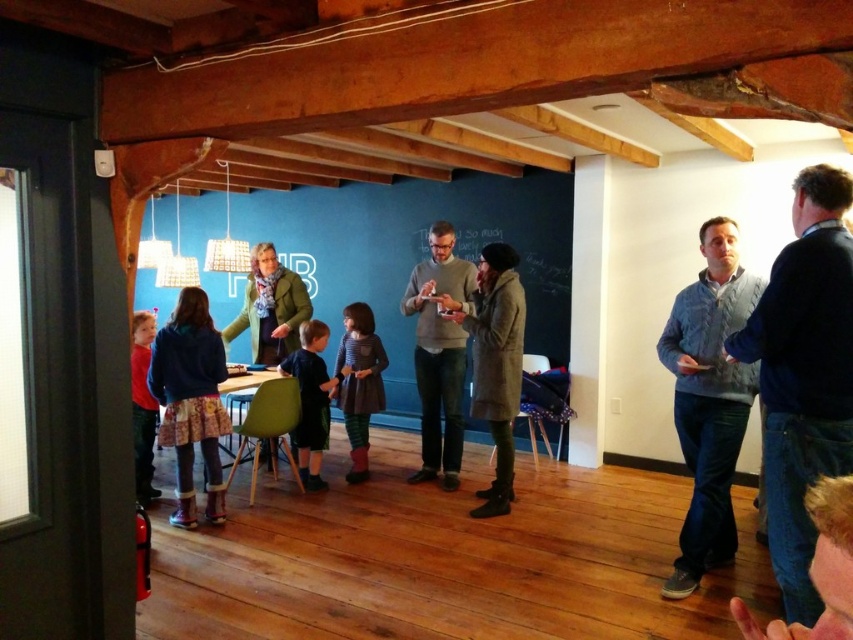
You are standing in the room and want to reach both the point at coordinates (480, 237) and the point at (206, 513). Which point will you reach first?

You will reach the point at coordinates (206, 513) first because it is closer to you than the point at (480, 237), which is further away.

You are a photographer setting up a shoot in this room. You have a camera that can capture a maximum width of 1.2 meters. You need to photograph both the fluffy pink boots at lower left and the dark blue shirt at center. Can you fit both items within the camera frame at the same time?

The fluffy pink boots at lower left are wider than the dark blue shirt at center. However, since the camera can capture up to 1.2 meters, and the combined width of both items would depend on their individual sizes. However, the description only states that the boots are wider than the shirt but does not provide exact measurements. Without knowing the exact widths, it is impossible to determine if they can both fit within the camera frame.

You are trying to reach the fluffy pink boots at lower left but there is a light blue sweater at right in your way. Can you move the sweater to access the boots?

The light blue sweater at right is in front of the fluffy pink boots at lower left, so you can move the sweater to access the boots.